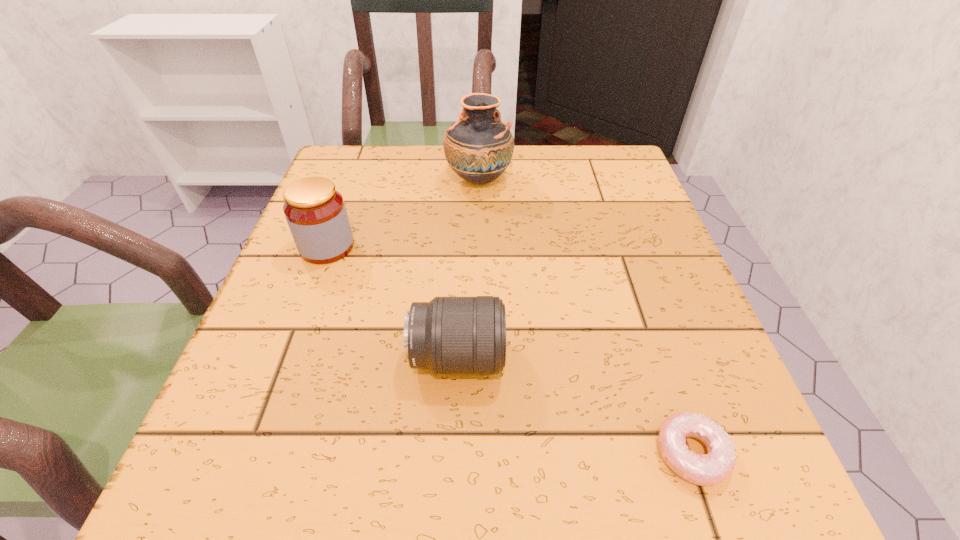
Find the location of a particular element. the tallest object is located at coordinates (479, 147).

Locate an element on the screen. pottery is located at coordinates tap(479, 147).

Locate an element on the screen. This screenshot has width=960, height=540. the second farthest object is located at coordinates (315, 211).

At what (x,y) coordinates should I click in order to perform the action: click on the leftmost object. Please return your answer as a coordinate pair (x, y). Image resolution: width=960 pixels, height=540 pixels. Looking at the image, I should click on (315, 211).

You are a GUI agent. You are given a task and a screenshot of the screen. Output one action in this format:
    pyautogui.click(x=<x>, y=<y>)
    Task: Click on the third farthest object
    
    Given the screenshot: What is the action you would take?
    pyautogui.click(x=449, y=335)

Where is `the third tallest object`? the third tallest object is located at coordinates click(449, 335).

Find the location of a particular element. doughnut is located at coordinates (705, 470).

You are a GUI agent. You are given a task and a screenshot of the screen. Output one action in this format:
    pyautogui.click(x=<x>, y=<y>)
    Task: Click on the rightmost object
    
    Given the screenshot: What is the action you would take?
    pyautogui.click(x=705, y=470)

Identify the location of free space located 0.050m on the left of the pottery. This screenshot has width=960, height=540. (424, 180).

I want to click on free location located on the right of the second tallest object, so click(537, 247).